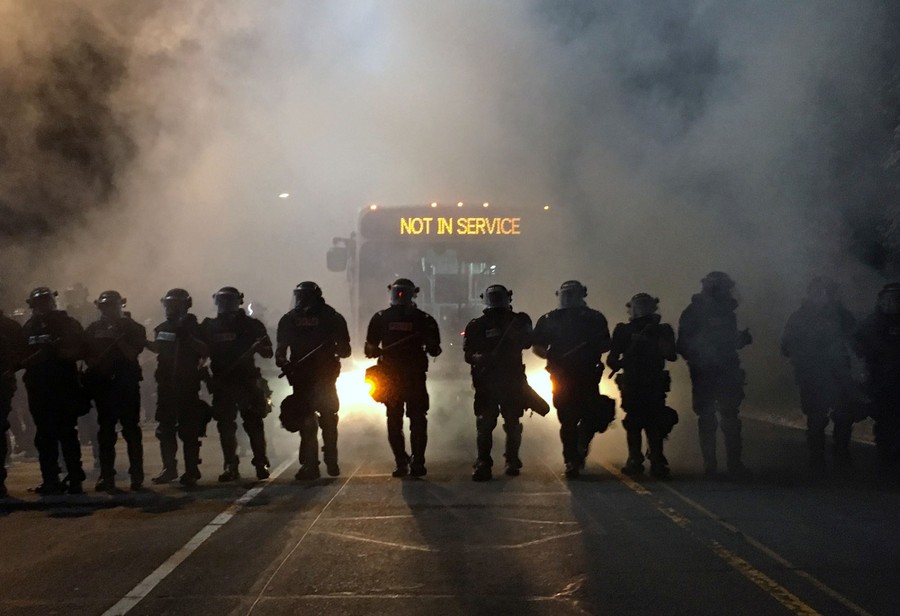
Find the location of a particular element. light is located at coordinates (347, 387).